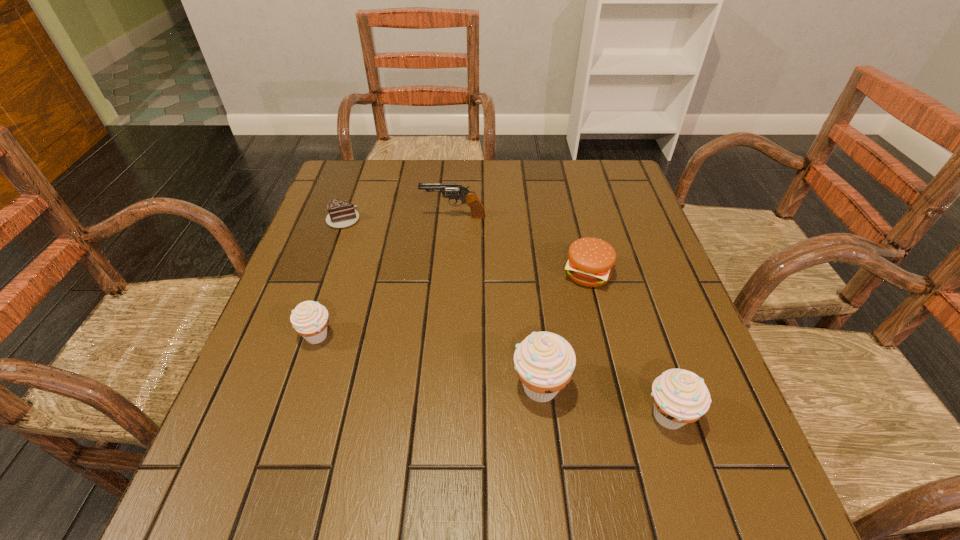
Locate an element on the screen. vacant position for inserting another muffin evenly is located at coordinates (423, 360).